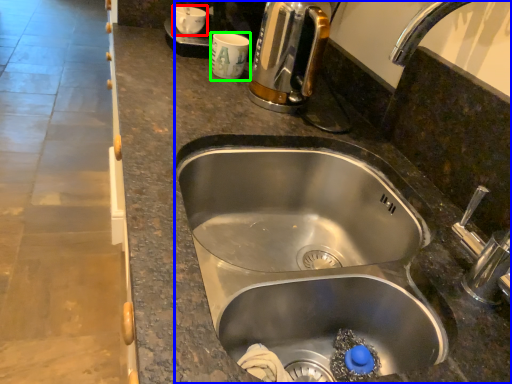
Question: Which object is the closest to the coffee cup (highlighted by a red box)? Choose among these: sink (highlighted by a blue box) or coffee cup (highlighted by a green box).

Choices:
 (A) sink
 (B) coffee cup

Answer: (B)